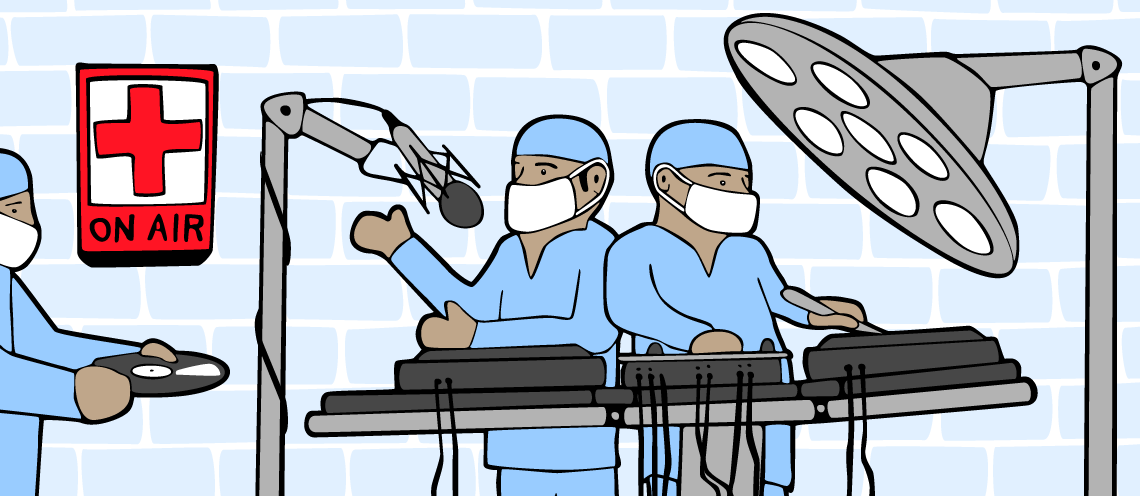
Where is `light`? This screenshot has width=1140, height=496. light is located at coordinates (966, 219).